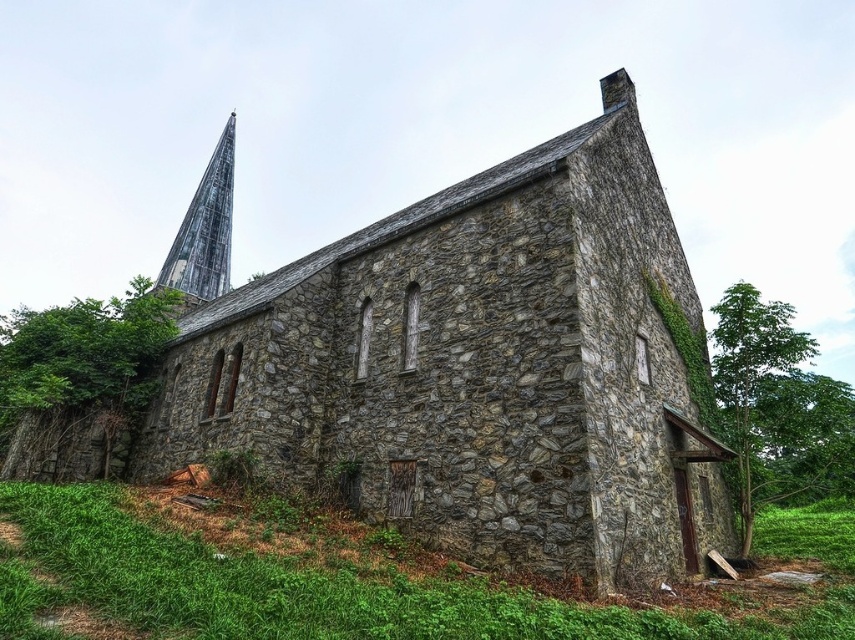
Does point (264, 637) lie in front of point (809, 438)?

Yes.

Which is more to the left, green grass at lower left or green leafy tree at right?

green grass at lower left

Does point (45, 596) lie in front of point (771, 394)?

Yes.

At what (x,y) coordinates should I click in order to perform the action: click on green grass at lower left. Please return your answer as a coordinate pair (x, y). This screenshot has height=640, width=855. Looking at the image, I should click on (313, 588).

Can you confirm if green grass at lower left is thinner than weathered gray stone spire at upper left?

Incorrect, green grass at lower left's width is not less than weathered gray stone spire at upper left's.

Which is behind, point (231, 573) or point (205, 184)?

Positioned behind is point (205, 184).

Locate an element on the screen. The height and width of the screenshot is (640, 855). green grass at lower left is located at coordinates (313, 588).

Between green leafy tree at left and weathered gray stone spire at upper left, which one is positioned higher?

weathered gray stone spire at upper left is above.

Does green leafy tree at left come behind weathered gray stone spire at upper left?

No.

Which is in front, point (15, 385) or point (195, 234)?

Positioned in front is point (15, 385).

Where is `green leafy tree at left`? This screenshot has height=640, width=855. green leafy tree at left is located at coordinates (81, 368).